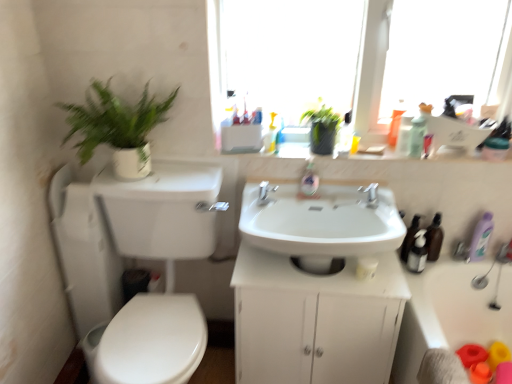
The image size is (512, 384). I want to click on vacant point to the left of translucent plastic bottle at upper right, positioned as the fourth toiletry in right-to-left order, so click(x=368, y=153).